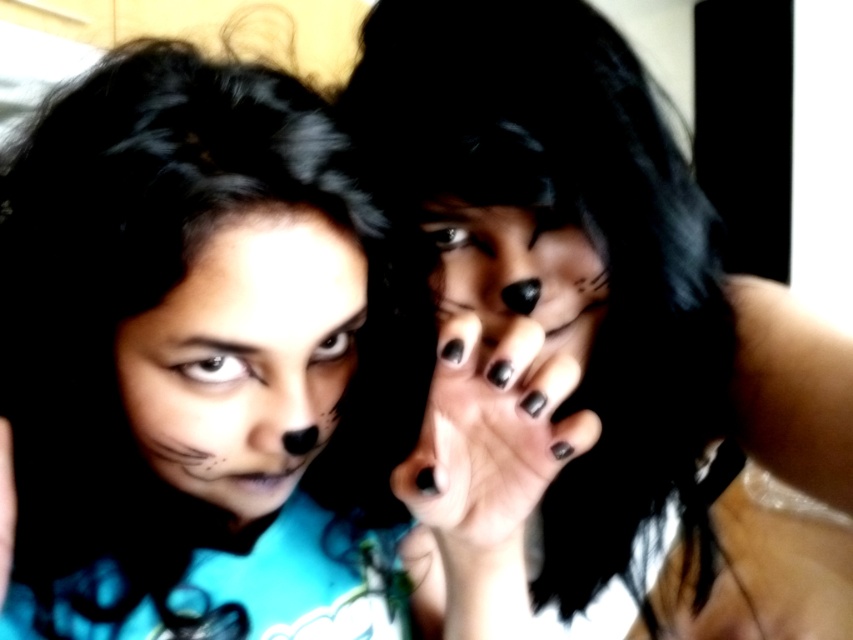
You are a photographer adjusting the lighting for a closeup shot of the two people in the image. You need to ensure that the matte black face paint at center and the matte black nails at center are both clearly visible. Based on their positions, which one might require more adjustment to avoid being overshadowed?

The matte black face paint at center is located below the matte black nails at center. Since the face paint is lower, it might be in shadow if the light source is above, so it could require more adjustment to ensure visibility.

You are a photographer adjusting the focus on a camera. You notice two matte black elements in the center of the image, the matte black face paint at center and the matte black nails at center. Which of these two elements appears bigger in the photo?

The matte black face paint at center is larger in size than the matte black nails at center, so the matte black face paint at center appears bigger in the photo.